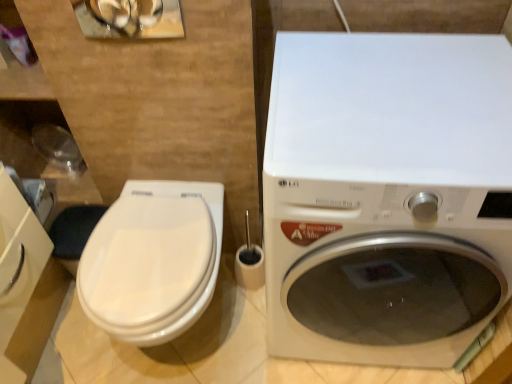
Question: Is the depth of white glossy toilet at left greater than that of white glossy washing machine at right?

Choices:
 (A) no
 (B) yes

Answer: (B)

Question: From the image's perspective, is white glossy toilet at left under white glossy washing machine at right?

Choices:
 (A) yes
 (B) no

Answer: (A)

Question: Is white glossy toilet at left taller than white glossy washing machine at right?

Choices:
 (A) yes
 (B) no

Answer: (B)

Question: Can you confirm if white glossy toilet at left is wider than white glossy washing machine at right?

Choices:
 (A) no
 (B) yes

Answer: (A)

Question: Could you tell me if white glossy toilet at left is facing white glossy washing machine at right?

Choices:
 (A) yes
 (B) no

Answer: (B)

Question: Is white glossy toilet at left to the left of white glossy washing machine at right from the viewer's perspective?

Choices:
 (A) no
 (B) yes

Answer: (B)

Question: From the image's perspective, does white glossy washing machine at right appear higher than white glossy toilet at left?

Choices:
 (A) no
 (B) yes

Answer: (B)

Question: Is white glossy washing machine at right to the left of white glossy toilet at left from the viewer's perspective?

Choices:
 (A) yes
 (B) no

Answer: (B)

Question: From a real-world perspective, does white glossy washing machine at right sit lower than white glossy toilet at left?

Choices:
 (A) no
 (B) yes

Answer: (A)

Question: Is the surface of white glossy washing machine at right in direct contact with white glossy toilet at left?

Choices:
 (A) no
 (B) yes

Answer: (A)

Question: Considering the relative sizes of white glossy washing machine at right and white glossy toilet at left in the image provided, is white glossy washing machine at right taller than white glossy toilet at left?

Choices:
 (A) no
 (B) yes

Answer: (B)

Question: Is white glossy washing machine at right further to camera compared to white glossy toilet at left?

Choices:
 (A) no
 (B) yes

Answer: (A)

Question: Considering the positions of white glossy washing machine at right and white glossy toilet at left in the image, is white glossy washing machine at right wider or thinner than white glossy toilet at left?

Choices:
 (A) wide
 (B) thin

Answer: (A)